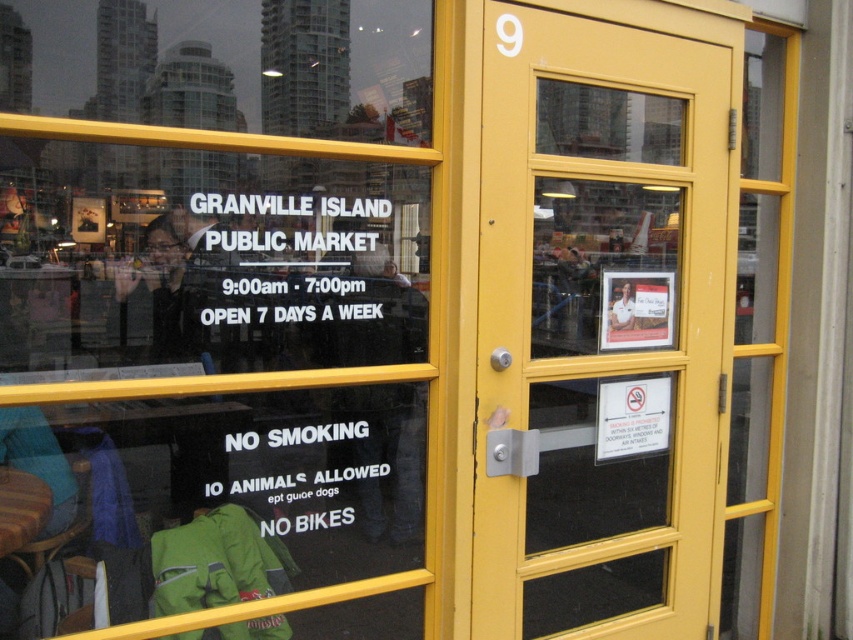
Question: Observing the image, what is the correct spatial positioning of white paper sign at lower center in reference to white paper sign at upper center?

Choices:
 (A) above
 (B) below

Answer: (B)

Question: Which point appears closest to the camera in this image?

Choices:
 (A) (247, 209)
 (B) (260, 483)

Answer: (A)

Question: Can you confirm if yellow glass door at center is wider than white paper sign at upper center?

Choices:
 (A) yes
 (B) no

Answer: (A)

Question: Which object is the closest to the white paper sign at lower center?

Choices:
 (A) yellow glass door at center
 (B) white paper sign at upper center

Answer: (B)

Question: Is yellow glass door at center wider than white paper sign at lower center?

Choices:
 (A) yes
 (B) no

Answer: (A)

Question: Which point is farther to the camera?

Choices:
 (A) (589, 3)
 (B) (209, 248)
 (C) (247, 456)

Answer: (A)